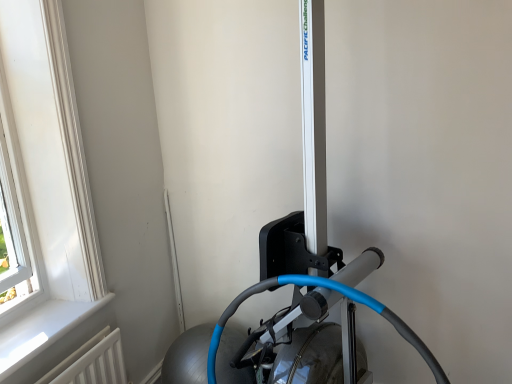
At what (x,y) coordinates should I click in order to perform the action: click on silver metallic rowing machine at center, arranged as the 1th sport equipment when viewed from the top. Please return your answer as a coordinate pair (x, y). This screenshot has width=512, height=384. Looking at the image, I should click on (296, 278).

What is the approximate width of white painted wood at lower left?

A: white painted wood at lower left is 23.89 centimeters wide.

Identify the location of white plastic window at upper left. (44, 187).

What are the coordinates of `silver metallic rowing machine at center, arranged as the 1th sport equipment when viewed from the top` in the screenshot? It's located at (296, 278).

From the image's perspective, between white plastic window at upper left and black rubber rowing machine at center, which is the first sport equipment from bottom to top, which one is located above?

white plastic window at upper left, from the image's perspective.

Considering the positions of objects white plastic window at upper left and black rubber rowing machine at center, which is the first sport equipment from bottom to top, in the image provided, who is more to the right, white plastic window at upper left or black rubber rowing machine at center, which is the first sport equipment from bottom to top,?

black rubber rowing machine at center, which is the first sport equipment from bottom to top, is more to the right.

Is white plastic window at upper left spatially inside black rubber rowing machine at center, which is the first sport equipment from bottom to top, or outside of it?

white plastic window at upper left is located beyond the bounds of black rubber rowing machine at center, which is the first sport equipment from bottom to top.

Which of these two, black rubber rowing machine at center, the 2th sport equipment positioned from the top, or white plastic window at upper left, is bigger?

Bigger between the two is black rubber rowing machine at center, the 2th sport equipment positioned from the top.

In the scene shown: Which object is positioned more to the right, black rubber rowing machine at center, the 2th sport equipment positioned from the top, or white plastic window at upper left?

Positioned to the right is black rubber rowing machine at center, the 2th sport equipment positioned from the top.

Is black rubber rowing machine at center, which is the first sport equipment from bottom to top, facing towards white plastic window at upper left?

No, black rubber rowing machine at center, which is the first sport equipment from bottom to top, is not facing towards white plastic window at upper left.

Looking at this image, what's the angular difference between black rubber rowing machine at center, which is the first sport equipment from bottom to top, and white plastic window at upper left's facing directions?

The angular difference between black rubber rowing machine at center, which is the first sport equipment from bottom to top, and white plastic window at upper left is 99.9 degrees.

From the image's perspective, which is below, white painted wood at lower left or white plastic window at upper left?

white painted wood at lower left appears lower in the image.

Who is smaller, white painted wood at lower left or white plastic window at upper left?

Smaller between the two is white painted wood at lower left.

Which is behind, white painted wood at lower left or white plastic window at upper left?

Positioned behind is white painted wood at lower left.

Which of these two, white painted wood at lower left or white plastic window at upper left, is wider?

white painted wood at lower left is wider.

Considering the positions of objects black rubber rowing machine at center, which is the first sport equipment from bottom to top, and silver metallic rowing machine at center, the second sport equipment ordered from the bottom, in the image provided, who is behind, black rubber rowing machine at center, which is the first sport equipment from bottom to top, or silver metallic rowing machine at center, the second sport equipment ordered from the bottom,?

black rubber rowing machine at center, which is the first sport equipment from bottom to top, is further from the camera.

Can you tell me how much black rubber rowing machine at center, which is the first sport equipment from bottom to top, and silver metallic rowing machine at center, the second sport equipment ordered from the bottom, differ in facing direction?

95.2 degrees separate the facing orientations of black rubber rowing machine at center, which is the first sport equipment from bottom to top, and silver metallic rowing machine at center, the second sport equipment ordered from the bottom.

Is black rubber rowing machine at center, the 2th sport equipment positioned from the top, shorter than silver metallic rowing machine at center, arranged as the 1th sport equipment when viewed from the top?

Correct, black rubber rowing machine at center, the 2th sport equipment positioned from the top, is not as tall as silver metallic rowing machine at center, arranged as the 1th sport equipment when viewed from the top.

From the image's perspective, which one is positioned lower, black rubber rowing machine at center, the 2th sport equipment positioned from the top, or silver metallic rowing machine at center, the second sport equipment ordered from the bottom?

black rubber rowing machine at center, the 2th sport equipment positioned from the top, appears lower in the image.

The height and width of the screenshot is (384, 512). What are the coordinates of `the 2nd sport equipment in front when counting from the white plastic window at upper left` in the screenshot? It's located at (296, 278).

Is silver metallic rowing machine at center, the second sport equipment ordered from the bottom, next to white plastic window at upper left?

They are not placed beside each other.

Is silver metallic rowing machine at center, the second sport equipment ordered from the bottom, taller than white plastic window at upper left?

Indeed, silver metallic rowing machine at center, the second sport equipment ordered from the bottom, has a greater height compared to white plastic window at upper left.

From the image's perspective, which is above, silver metallic rowing machine at center, arranged as the 1th sport equipment when viewed from the top, or white plastic window at upper left?

white plastic window at upper left.

Between white painted wood at lower left and silver metallic rowing machine at center, the second sport equipment ordered from the bottom, which one has more height?

silver metallic rowing machine at center, the second sport equipment ordered from the bottom, is taller.

Can you confirm if white painted wood at lower left is thinner than silver metallic rowing machine at center, the second sport equipment ordered from the bottom?

Yes, white painted wood at lower left is thinner than silver metallic rowing machine at center, the second sport equipment ordered from the bottom.

Between white painted wood at lower left and silver metallic rowing machine at center, arranged as the 1th sport equipment when viewed from the top, which one has smaller size?

Smaller between the two is white painted wood at lower left.

Is white painted wood at lower left situated inside silver metallic rowing machine at center, arranged as the 1th sport equipment when viewed from the top, or outside?

white painted wood at lower left lies outside silver metallic rowing machine at center, arranged as the 1th sport equipment when viewed from the top.

Are silver metallic rowing machine at center, the second sport equipment ordered from the bottom, and white painted wood at lower left located far from each other?

silver metallic rowing machine at center, the second sport equipment ordered from the bottom, is near white painted wood at lower left, not far away.

Can you tell me how much silver metallic rowing machine at center, the second sport equipment ordered from the bottom, and white painted wood at lower left differ in facing direction?

They differ by 4.62 degrees in their facing directions.

Does silver metallic rowing machine at center, the second sport equipment ordered from the bottom, turn towards white painted wood at lower left?

No, silver metallic rowing machine at center, the second sport equipment ordered from the bottom, is not facing towards white painted wood at lower left.

From the image's perspective, between silver metallic rowing machine at center, arranged as the 1th sport equipment when viewed from the top, and white painted wood at lower left, who is located below?

white painted wood at lower left, from the image's perspective.

Locate an element on the screen. the 2nd sport equipment positioned below the white plastic window at upper left (from the image's perspective) is located at coordinates (326, 288).

The width and height of the screenshot is (512, 384). Find the location of `the 1st sport equipment in front of the white plastic window at upper left`. the 1st sport equipment in front of the white plastic window at upper left is located at coordinates (326, 288).

When comparing their distances from white plastic window at upper left, does black rubber rowing machine at center, which is the first sport equipment from bottom to top, or white painted wood at lower left seem further?

black rubber rowing machine at center, which is the first sport equipment from bottom to top, is positioned further to the anchor white plastic window at upper left.

Estimate the real-world distances between objects in this image. Which object is further from silver metallic rowing machine at center, arranged as the 1th sport equipment when viewed from the top, white painted wood at lower left or black rubber rowing machine at center, which is the first sport equipment from bottom to top?

white painted wood at lower left is further to silver metallic rowing machine at center, arranged as the 1th sport equipment when viewed from the top.

In the scene shown: Estimate the real-world distances between objects in this image. Which object is further from white plastic window at upper left, black rubber rowing machine at center, the 2th sport equipment positioned from the top, or silver metallic rowing machine at center, arranged as the 1th sport equipment when viewed from the top?

black rubber rowing machine at center, the 2th sport equipment positioned from the top, lies further to white plastic window at upper left than the other object.

Considering their positions, is white painted wood at lower left positioned closer to white plastic window at upper left than silver metallic rowing machine at center, arranged as the 1th sport equipment when viewed from the top?

white painted wood at lower left is closer to white plastic window at upper left.

Looking at this image, based on their spatial positions, is white plastic window at upper left or silver metallic rowing machine at center, arranged as the 1th sport equipment when viewed from the top, closer to black rubber rowing machine at center, which is the first sport equipment from bottom to top?

silver metallic rowing machine at center, arranged as the 1th sport equipment when viewed from the top, is closer to black rubber rowing machine at center, which is the first sport equipment from bottom to top.

From the image, which object appears to be nearer to black rubber rowing machine at center, which is the first sport equipment from bottom to top, white painted wood at lower left or silver metallic rowing machine at center, the second sport equipment ordered from the bottom?

Based on the image, silver metallic rowing machine at center, the second sport equipment ordered from the bottom, appears to be nearer to black rubber rowing machine at center, which is the first sport equipment from bottom to top.

Which object lies further to the anchor point white plastic window at upper left, silver metallic rowing machine at center, arranged as the 1th sport equipment when viewed from the top, or black rubber rowing machine at center, which is the first sport equipment from bottom to top?

Among the two, black rubber rowing machine at center, which is the first sport equipment from bottom to top, is located further to white plastic window at upper left.

From the image, which object appears to be farther from white painted wood at lower left, white plastic window at upper left or black rubber rowing machine at center, which is the first sport equipment from bottom to top?

The object further to white painted wood at lower left is black rubber rowing machine at center, which is the first sport equipment from bottom to top.

Locate an element on the screen. Image resolution: width=512 pixels, height=384 pixels. window sill situated between white plastic window at upper left and black rubber rowing machine at center, which is the first sport equipment from bottom to top, from left to right is located at coordinates (42, 337).

The height and width of the screenshot is (384, 512). In order to click on sport equipment between white plastic window at upper left and black rubber rowing machine at center, the 2th sport equipment positioned from the top, in the horizontal direction in this screenshot , I will do `click(296, 278)`.

Locate an element on the screen. sport equipment between white painted wood at lower left and black rubber rowing machine at center, the 2th sport equipment positioned from the top, from left to right is located at coordinates (296, 278).

You are a GUI agent. You are given a task and a screenshot of the screen. Output one action in this format:
    pyautogui.click(x=<x>, y=<y>)
    Task: Click on the window sill situated between white plastic window at upper left and silver metallic rowing machine at center, the second sport equipment ordered from the bottom, from left to right
    This screenshot has width=512, height=384.
    Given the screenshot: What is the action you would take?
    click(x=42, y=337)